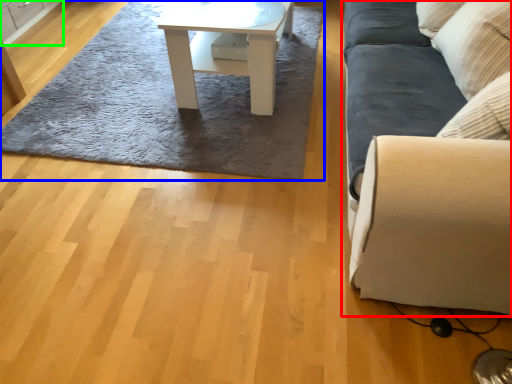
Question: Based on their relative distances, which object is farther from studio couch (highlighted by a red box)? Choose from mat (highlighted by a blue box) and cabinetry (highlighted by a green box).

Choices:
 (A) mat
 (B) cabinetry

Answer: (B)